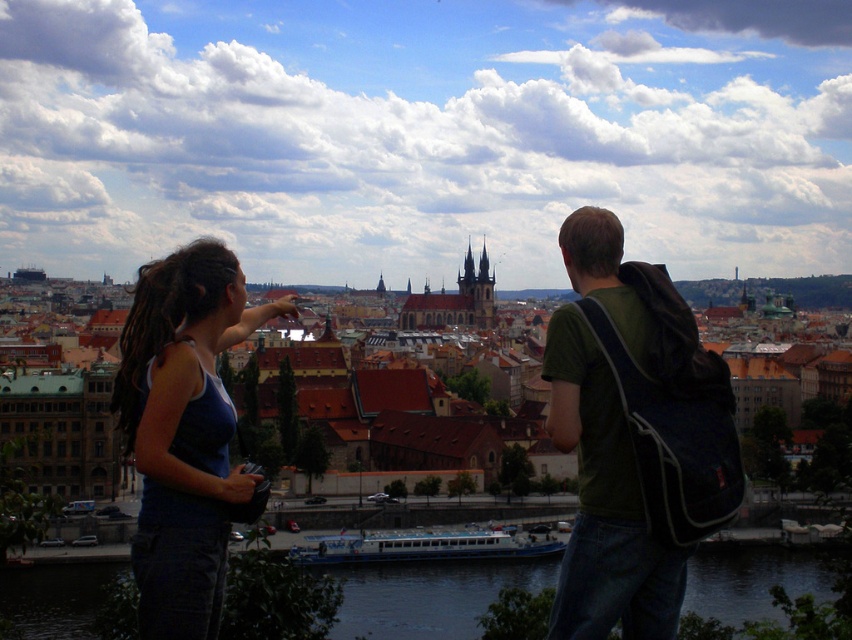
You are standing at the viewpoint and want to take a photo of both the large church with tall spires and the person on the right who is carrying a black backpack. You notice two points marked in the scene. If you position yourself at point [594,337], will you be able to see both the large church with tall spires and the person on the right at point [643,525]?

Point [594,337] is behind point [643,525], so positioning yourself there might block your view of the person on the right at point [643,525]. You may need to adjust your position to ensure both are visible.